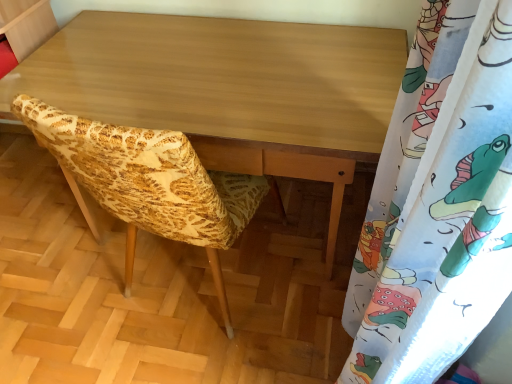
Question: Is light brown wood desk at center situated inside yellow fabric chair at center or outside?

Choices:
 (A) outside
 (B) inside

Answer: (A)

Question: Is light brown wood desk at center taller or shorter than yellow fabric chair at center?

Choices:
 (A) short
 (B) tall

Answer: (B)

Question: Which is nearer to the light brown wood desk at center?

Choices:
 (A) yellow fabric chair at center
 (B) white fabric with colorful cartoon print at right

Answer: (A)

Question: Which of these objects is positioned closest to the light brown wood desk at center?

Choices:
 (A) yellow fabric chair at center
 (B) white fabric with colorful cartoon print at right

Answer: (A)